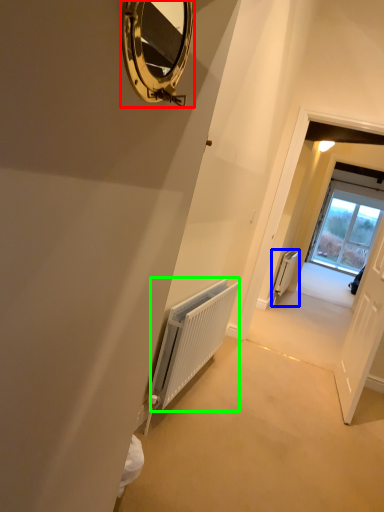
Question: Which object is positioned closest to mirror (highlighted by a red box)? Select from radiator (highlighted by a blue box) and radiator (highlighted by a green box).

Choices:
 (A) radiator
 (B) radiator

Answer: (B)